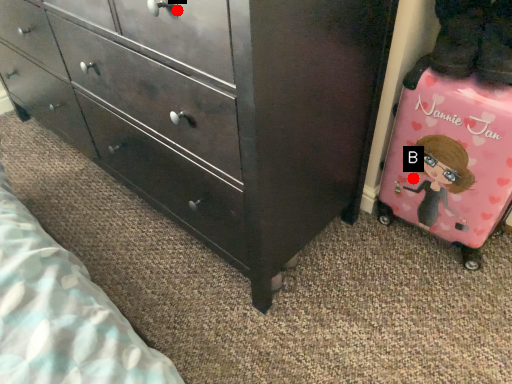
Question: Two points are circled on the image, labeled by A and B beside each circle. Which point appears closest to the camera in this image?

Choices:
 (A) A is closer
 (B) B is closer

Answer: (A)